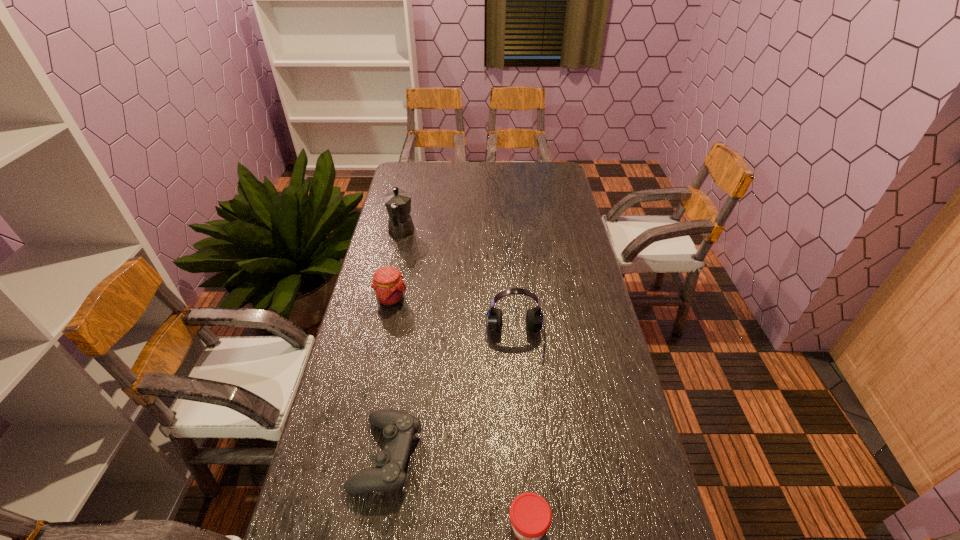
Image resolution: width=960 pixels, height=540 pixels. What are the coordinates of `object that is the fourth closest one to the nearer jam` in the screenshot? It's located at (398, 202).